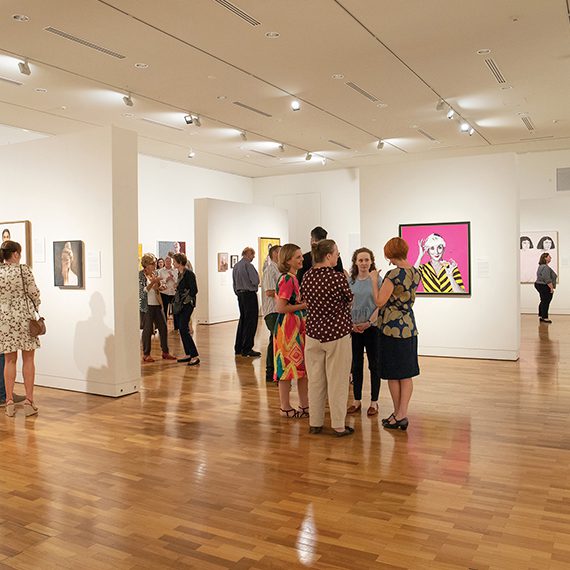
The width and height of the screenshot is (570, 570). I want to click on floor, so click(477, 508).